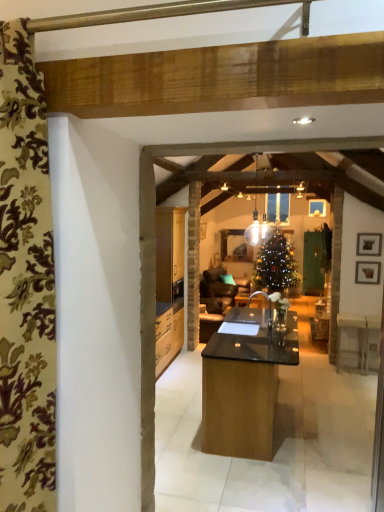
Locate an element on the screen. This screenshot has height=512, width=384. wooden picture frame at right, the first picture frame in the bottom-to-top sequence is located at coordinates (367, 272).

Is floral fabric curtain at left oriented away from black matte picture frame at upper right, the 2th picture frame positioned from the bottom?

floral fabric curtain at left is not turned away from black matte picture frame at upper right, the 2th picture frame positioned from the bottom.

From a real-world perspective, is floral fabric curtain at left above or below black matte picture frame at upper right, which is the first picture frame from top to bottom?

In terms of real-world spatial position, floral fabric curtain at left is above black matte picture frame at upper right, which is the first picture frame from top to bottom.

Does floral fabric curtain at left contain black matte picture frame at upper right, the 2th picture frame positioned from the bottom?

Actually, black matte picture frame at upper right, the 2th picture frame positioned from the bottom, is outside floral fabric curtain at left.

Based on the photo, is black matte picture frame at upper right, which is the first picture frame from top to bottom, turned away from wooden picture frame at right, the first picture frame in the bottom-to-top sequence?

No.

From the image's perspective, relative to wooden picture frame at right, the first picture frame in the bottom-to-top sequence, is black matte picture frame at upper right, which is the first picture frame from top to bottom, above or below?

Clearly, from the image's perspective, black matte picture frame at upper right, which is the first picture frame from top to bottom, is above wooden picture frame at right, the first picture frame in the bottom-to-top sequence.

From a real-world perspective, which is physically below, black matte picture frame at upper right, which is the first picture frame from top to bottom, or wooden picture frame at right, which is the 2th picture frame from top to bottom?

wooden picture frame at right, which is the 2th picture frame from top to bottom.

Is translucent glass pendant light at center at the left side of floral fabric curtain at left?

Incorrect, translucent glass pendant light at center is not on the left side of floral fabric curtain at left.

From the image's perspective, is translucent glass pendant light at center positioned above or below floral fabric curtain at left?

Clearly, from the image's perspective, translucent glass pendant light at center is above floral fabric curtain at left.

Is translucent glass pendant light at center turned away from floral fabric curtain at left?

translucent glass pendant light at center does not have its back to floral fabric curtain at left.

Considering the relative sizes of translucent glass pendant light at center and floral fabric curtain at left in the image provided, is translucent glass pendant light at center taller than floral fabric curtain at left?

In fact, translucent glass pendant light at center may be shorter than floral fabric curtain at left.

Which is in front, point (369, 242) or point (37, 347)?

The point (37, 347) is in front.

Are black matte picture frame at upper right, which is the first picture frame from top to bottom, and floral fabric curtain at left beside each other?

black matte picture frame at upper right, which is the first picture frame from top to bottom, and floral fabric curtain at left are not in contact.

From the image's perspective, between black matte picture frame at upper right, the 2th picture frame positioned from the bottom, and floral fabric curtain at left, who is located below?

floral fabric curtain at left appears lower in the image.

Which of these two, black matte picture frame at upper right, the 2th picture frame positioned from the bottom, or floral fabric curtain at left, stands shorter?

With less height is black matte picture frame at upper right, the 2th picture frame positioned from the bottom.

Based on the photo, are wooden picture frame at right, the first picture frame in the bottom-to-top sequence, and black matte picture frame at upper right, the 2th picture frame positioned from the bottom, beside each other?

No, wooden picture frame at right, the first picture frame in the bottom-to-top sequence, is not beside black matte picture frame at upper right, the 2th picture frame positioned from the bottom.

Between wooden picture frame at right, the first picture frame in the bottom-to-top sequence, and black matte picture frame at upper right, which is the first picture frame from top to bottom, which one has larger width?

black matte picture frame at upper right, which is the first picture frame from top to bottom.

Between wooden picture frame at right, the first picture frame in the bottom-to-top sequence, and black matte picture frame at upper right, which is the first picture frame from top to bottom, which one appears on the left side from the viewer's perspective?

From the viewer's perspective, wooden picture frame at right, the first picture frame in the bottom-to-top sequence, appears more on the left side.

Could you measure the distance between wooden picture frame at right, which is the 2th picture frame from top to bottom, and black matte picture frame at upper right, the 2th picture frame positioned from the bottom?

wooden picture frame at right, which is the 2th picture frame from top to bottom, is 8.15 inches away from black matte picture frame at upper right, the 2th picture frame positioned from the bottom.

Considering the relative positions of floral fabric curtain at left and wooden picture frame at right, the first picture frame in the bottom-to-top sequence, in the image provided, is floral fabric curtain at left to the left or to the right of wooden picture frame at right, the first picture frame in the bottom-to-top sequence,?

From the image, it's evident that floral fabric curtain at left is to the left of wooden picture frame at right, the first picture frame in the bottom-to-top sequence.

Can you confirm if floral fabric curtain at left is thinner than wooden picture frame at right, which is the 2th picture frame from top to bottom?

No.

Can you see floral fabric curtain at left touching wooden picture frame at right, the first picture frame in the bottom-to-top sequence?

No, floral fabric curtain at left is not making contact with wooden picture frame at right, the first picture frame in the bottom-to-top sequence.

From the image's perspective, which one is positioned higher, floral fabric curtain at left or wooden picture frame at right, the first picture frame in the bottom-to-top sequence?

floral fabric curtain at left appears higher in the image.

Is floral fabric curtain at left closer to camera compared to translucent glass pendant light at center?

Yes, it is in front of translucent glass pendant light at center.

Looking at this image, are floral fabric curtain at left and translucent glass pendant light at center beside each other?

They are not placed beside each other.

Does point (12, 412) lie behind point (257, 153)?

No, it is in front of (257, 153).

Does floral fabric curtain at left have a lesser height compared to translucent glass pendant light at center?

No, floral fabric curtain at left is not shorter than translucent glass pendant light at center.

I want to click on the 1st picture frame behind when counting from the floral fabric curtain at left, so 369,244.

The image size is (384, 512). In order to click on picture frame above the wooden picture frame at right, the first picture frame in the bottom-to-top sequence (from the image's perspective) in this screenshot , I will do `click(369, 244)`.

Which object lies further to the anchor point translucent glass pendant light at center, black matte picture frame at upper right, the 2th picture frame positioned from the bottom, or wooden picture frame at right, which is the 2th picture frame from top to bottom?

wooden picture frame at right, which is the 2th picture frame from top to bottom, is positioned further to the anchor translucent glass pendant light at center.

Estimate the real-world distances between objects in this image. Which object is further from floral fabric curtain at left, black matte picture frame at upper right, which is the first picture frame from top to bottom, or wooden picture frame at right, the first picture frame in the bottom-to-top sequence?

black matte picture frame at upper right, which is the first picture frame from top to bottom, lies further to floral fabric curtain at left than the other object.

Which object lies nearer to the anchor point translucent glass pendant light at center, wooden picture frame at right, the first picture frame in the bottom-to-top sequence, or black matte picture frame at upper right, which is the first picture frame from top to bottom?

black matte picture frame at upper right, which is the first picture frame from top to bottom, lies closer to translucent glass pendant light at center than the other object.

From the image, which object appears to be farther from black matte picture frame at upper right, the 2th picture frame positioned from the bottom, translucent glass pendant light at center or floral fabric curtain at left?

Among the two, floral fabric curtain at left is located further to black matte picture frame at upper right, the 2th picture frame positioned from the bottom.

Based on their spatial positions, is black matte picture frame at upper right, the 2th picture frame positioned from the bottom, or translucent glass pendant light at center further from wooden picture frame at right, the first picture frame in the bottom-to-top sequence?

translucent glass pendant light at center is positioned further to the anchor wooden picture frame at right, the first picture frame in the bottom-to-top sequence.

From the image, which object appears to be nearer to wooden picture frame at right, which is the 2th picture frame from top to bottom, translucent glass pendant light at center or floral fabric curtain at left?

Based on the image, translucent glass pendant light at center appears to be nearer to wooden picture frame at right, which is the 2th picture frame from top to bottom.

Looking at the image, which one is located further to floral fabric curtain at left, wooden picture frame at right, which is the 2th picture frame from top to bottom, or translucent glass pendant light at center?

Among the two, translucent glass pendant light at center is located further to floral fabric curtain at left.

Estimate the real-world distances between objects in this image. Which object is closer to black matte picture frame at upper right, the 2th picture frame positioned from the bottom, floral fabric curtain at left or wooden picture frame at right, which is the 2th picture frame from top to bottom?

wooden picture frame at right, which is the 2th picture frame from top to bottom, is closer to black matte picture frame at upper right, the 2th picture frame positioned from the bottom.

Locate an element on the screen. This screenshot has height=512, width=384. picture frame located between translucent glass pendant light at center and wooden picture frame at right, the first picture frame in the bottom-to-top sequence, in the depth direction is located at coordinates (369, 244).

This screenshot has width=384, height=512. I want to click on light fixture between floral fabric curtain at left and wooden picture frame at right, the first picture frame in the bottom-to-top sequence, from front to back, so click(x=258, y=229).

Find the location of a particular element. The height and width of the screenshot is (512, 384). light fixture between floral fabric curtain at left and black matte picture frame at upper right, the 2th picture frame positioned from the bottom, in the front-back direction is located at coordinates (258, 229).

Locate an element on the screen. This screenshot has height=512, width=384. picture frame between floral fabric curtain at left and wooden picture frame at right, the first picture frame in the bottom-to-top sequence, in the front-back direction is located at coordinates point(369,244).